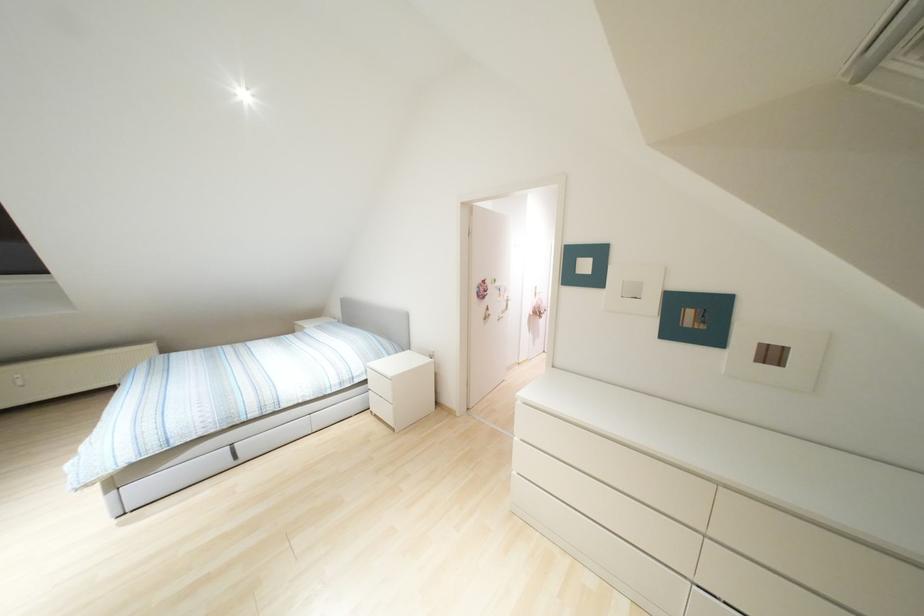
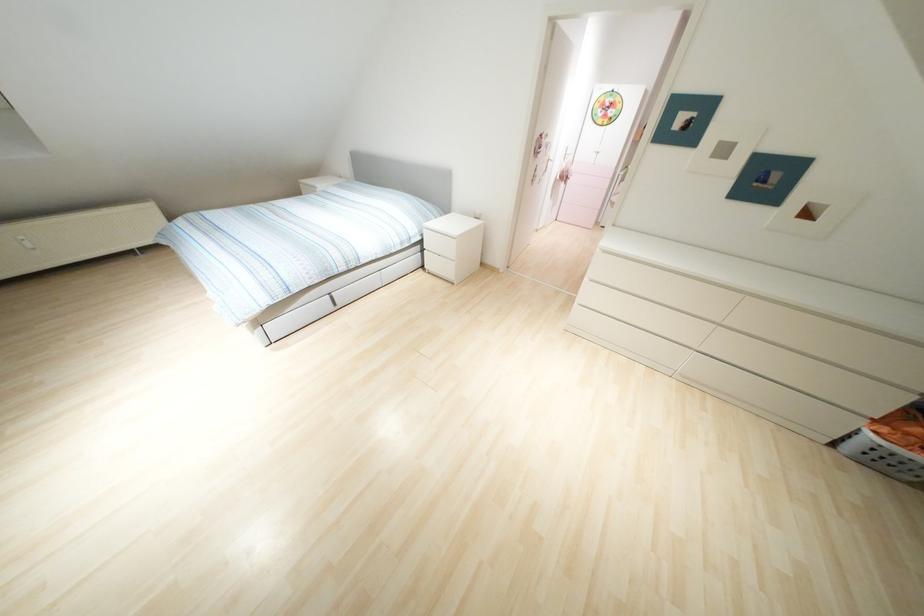
Question: Which direction would the cameraman need to move to produce the second image? Reply with the corresponding letter.

Choices:
 (A) Left
 (B) Right
 (C) Forward
 (D) Backward

Answer: (A)